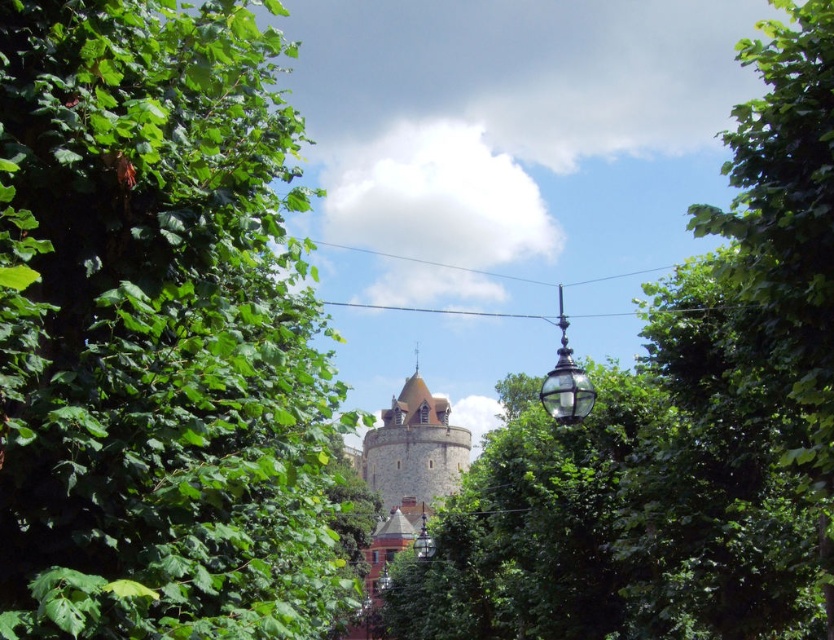
Can you confirm if green leafy tree at center is thinner than stone tower at center?

No.

Is green leafy tree at center bigger than stone tower at center?

Yes, green leafy tree at center is bigger than stone tower at center.

Locate an element on the screen. This screenshot has height=640, width=834. green leafy tree at center is located at coordinates (677, 424).

Which of these two, green leafy tree at left or green leafy tree at center, stands shorter?

Standing shorter between the two is green leafy tree at center.

Image resolution: width=834 pixels, height=640 pixels. I want to click on green leafy tree at left, so click(x=159, y=332).

Can you confirm if green leafy tree at left is taller than stone tower at center?

Yes.

Is green leafy tree at left smaller than stone tower at center?

No.

Find the location of a particular element. The width and height of the screenshot is (834, 640). green leafy tree at left is located at coordinates (159, 332).

The width and height of the screenshot is (834, 640). What are the coordinates of `green leafy tree at left` in the screenshot? It's located at (159, 332).